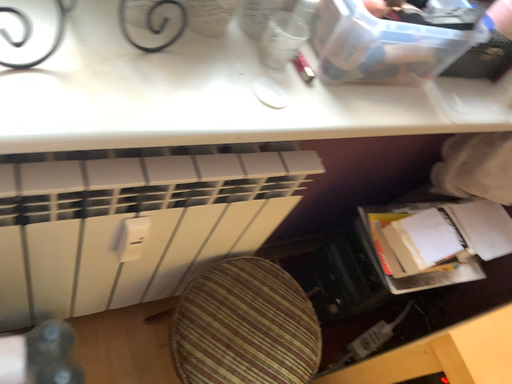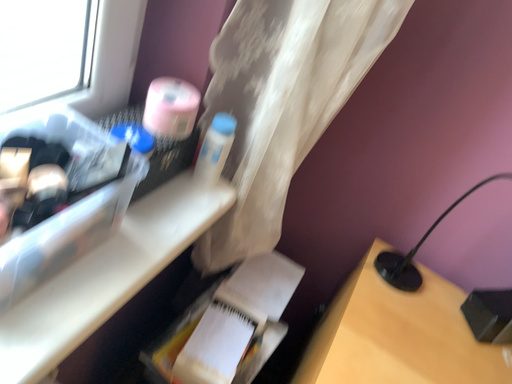
Question: How did the camera likely rotate when shooting the video?

Choices:
 (A) rotated upward
 (B) rotated downward

Answer: (A)